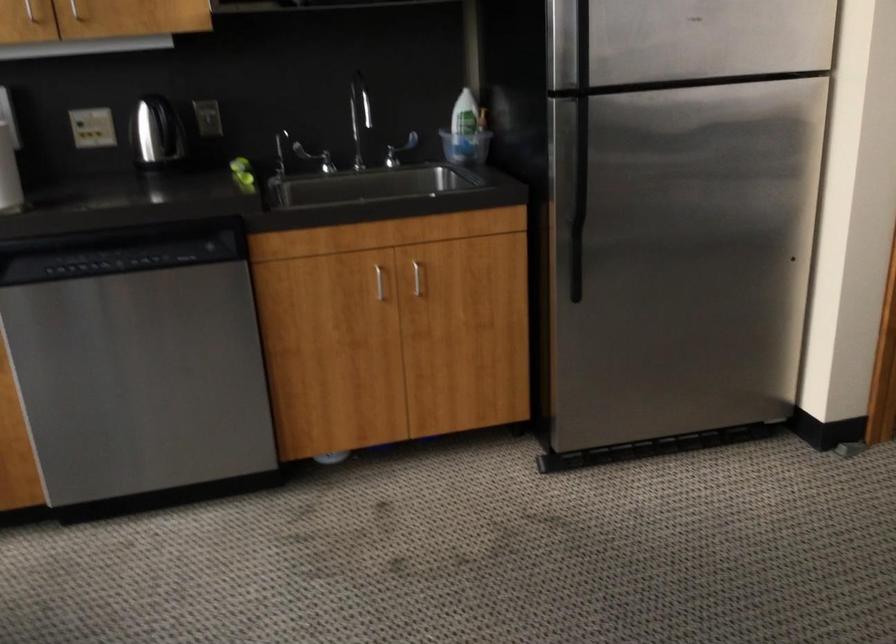
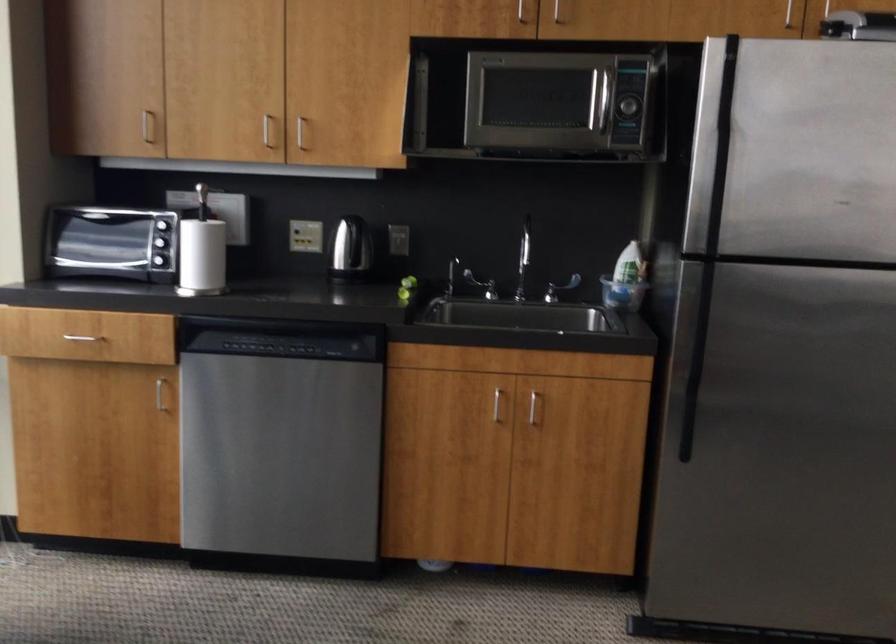
Find the pixel in the second image that matches (x=309, y=156) in the first image.

(480, 285)